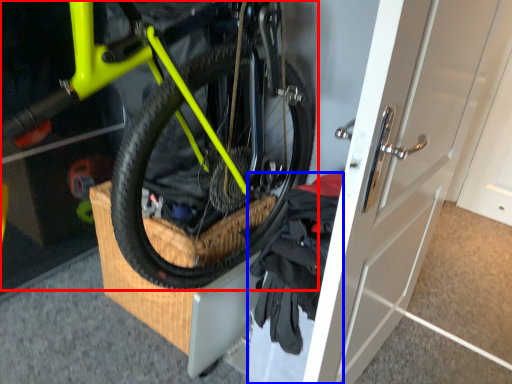
Question: Which point is closer to the camera, bicycle (highlighted by a red box) or clothing (highlighted by a blue box)?

Choices:
 (A) bicycle
 (B) clothing

Answer: (A)